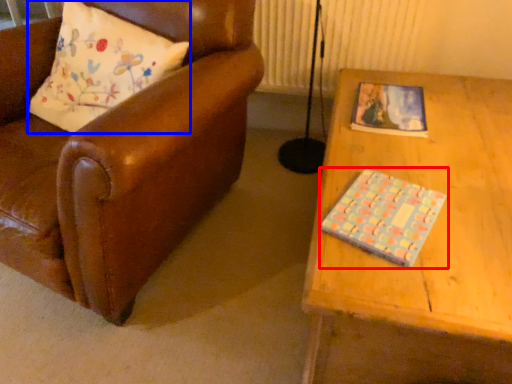
Question: Among these objects, which one is farthest to the camera, book (highlighted by a red box) or pillow (highlighted by a blue box)?

Choices:
 (A) book
 (B) pillow

Answer: (B)